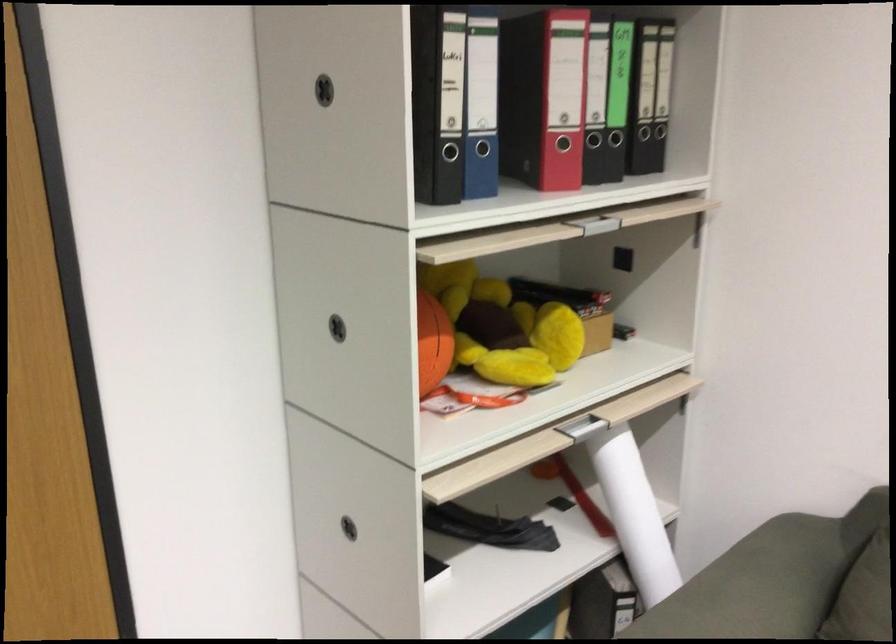
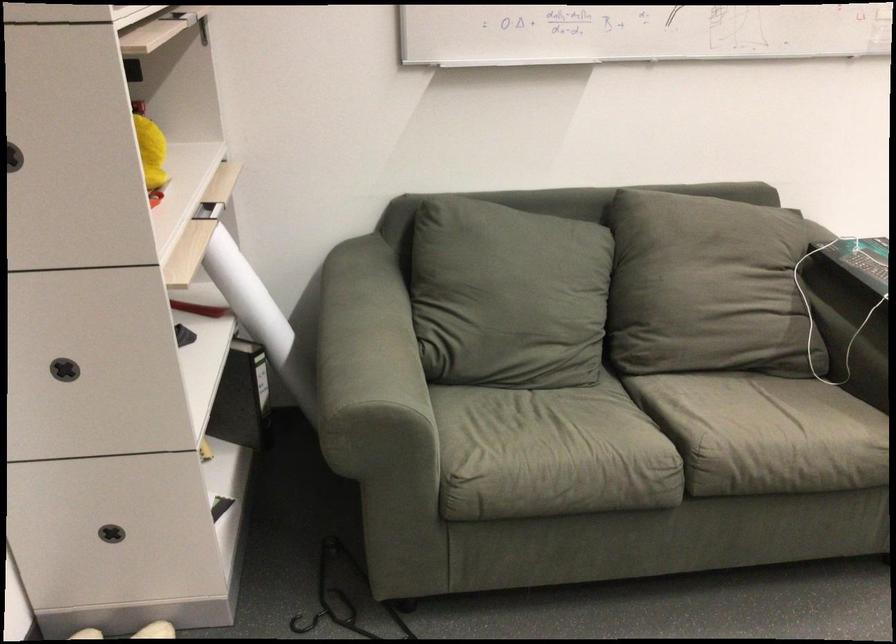
Where in the second image is the point corresponding to (627,523) from the first image?

(247, 296)